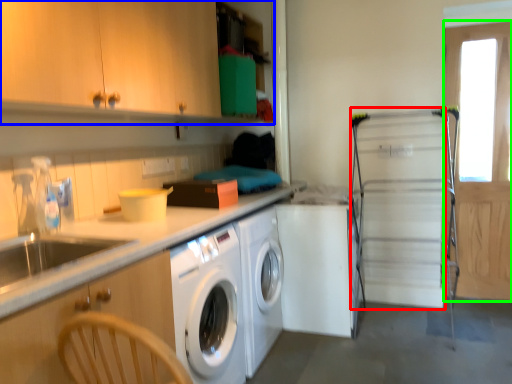
Question: Which object is positioned closest to screen door (highlighted by a red box)? Select from cabinetry (highlighted by a blue box) and screen door (highlighted by a green box).

Choices:
 (A) cabinetry
 (B) screen door

Answer: (B)